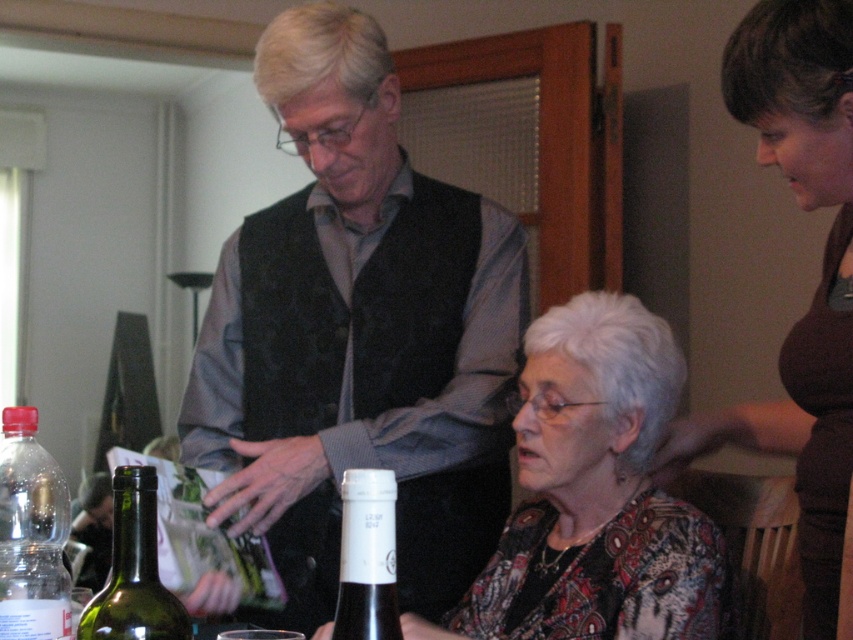
Question: In this image, where is patterned fabric blouse at center located relative to black glass wine bottle at lower center?

Choices:
 (A) below
 (B) above

Answer: (A)

Question: Considering the relative positions of brown fabric shirt at upper right and green glass bottle at lower left in the image provided, where is brown fabric shirt at upper right located with respect to green glass bottle at lower left?

Choices:
 (A) below
 (B) above

Answer: (B)

Question: Which point is farther to the camera?

Choices:
 (A) (270, 340)
 (B) (146, 556)
 (C) (817, 538)

Answer: (A)

Question: Is patterned fabric blouse at center below black glass wine bottle at lower center?

Choices:
 (A) yes
 (B) no

Answer: (A)

Question: Which of the following is the closest to the observer?

Choices:
 (A) black glass wine bottle at lower center
 (B) patterned fabric blouse at center
 (C) transparent plastic bottle at lower left
 (D) brown fabric shirt at upper right

Answer: (A)

Question: Which point is closer to the camera taking this photo?

Choices:
 (A) (21, 470)
 (B) (120, 520)
 (C) (401, 518)

Answer: (B)